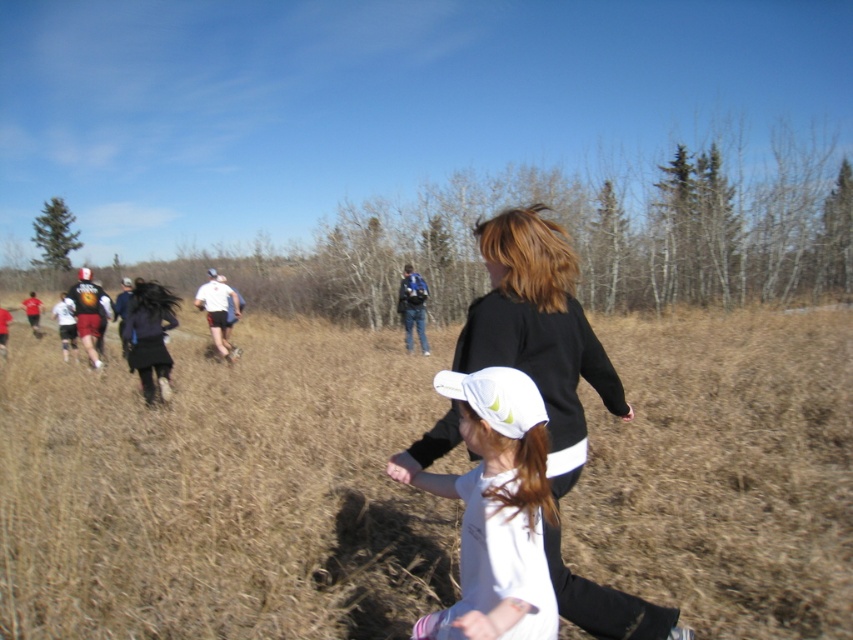
Question: Which of the following is the closest to the observer?

Choices:
 (A) white matte dress at center
 (B) black matte jacket at center

Answer: (A)

Question: Is brown dry grass at center to the right of matte blue backpack at center from the viewer's perspective?

Choices:
 (A) yes
 (B) no

Answer: (A)

Question: Based on their relative distances, which object is nearer to the white matte shorts at center?

Choices:
 (A) black matte jacket at center
 (B) matte blue backpack at center
 (C) brown dry grass at center

Answer: (B)

Question: Which is nearer to the matte blue backpack at center?

Choices:
 (A) white matte dress at center
 (B) white matte shorts at center

Answer: (B)

Question: Is black matte jacket at center thinner than white matte dress at center?

Choices:
 (A) yes
 (B) no

Answer: (B)

Question: Can you confirm if brown dry grass at center is wider than white matte shorts at center?

Choices:
 (A) no
 (B) yes

Answer: (B)